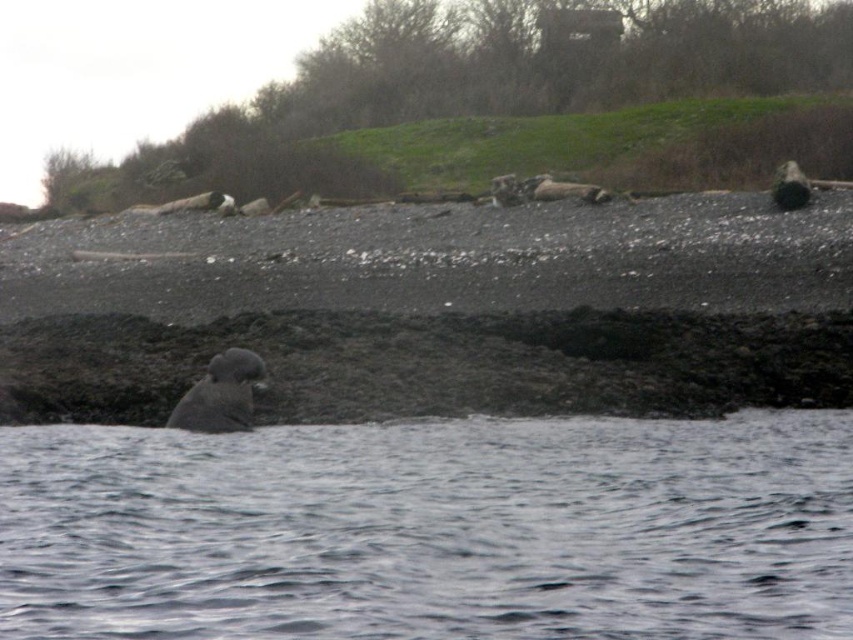
Can you confirm if clear water at lower center is wider than gray fur seal at center?

Yes, clear water at lower center is wider than gray fur seal at center.

The width and height of the screenshot is (853, 640). I want to click on clear water at lower center, so click(432, 529).

Locate an element on the screen. The height and width of the screenshot is (640, 853). clear water at lower center is located at coordinates (432, 529).